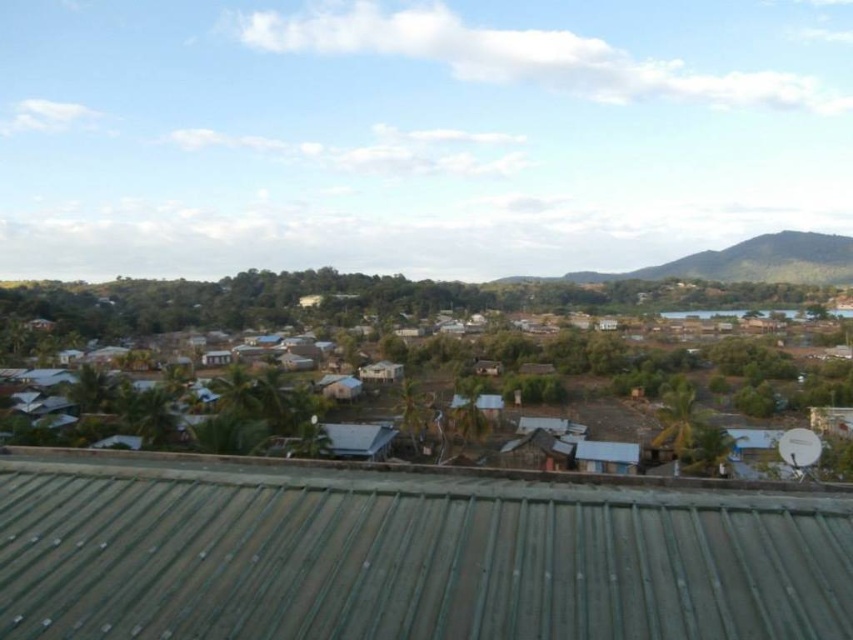
Is metallic roofs at center wider than green textured hill at upper right?

Indeed, metallic roofs at center has a greater width compared to green textured hill at upper right.

Between metallic roofs at center and green textured hill at upper right, which one has more height?

metallic roofs at center is taller.

The width and height of the screenshot is (853, 640). What are the coordinates of `metallic roofs at center` in the screenshot? It's located at (469, 346).

Is green corrugated metal roof at center to the left of green textured hill at upper right from the viewer's perspective?

Correct, you'll find green corrugated metal roof at center to the left of green textured hill at upper right.

Is point (640, 552) behind point (764, 280)?

That is False.

Describe the element at coordinates (405, 557) in the screenshot. I see `green corrugated metal roof at center` at that location.

Identify the location of green corrugated metal roof at center. This screenshot has width=853, height=640. (405, 557).

Does green corrugated metal roof at center have a greater width compared to metallic roofs at center?

No.

Between green corrugated metal roof at center and metallic roofs at center, which one has less height?

Standing shorter between the two is green corrugated metal roof at center.

The height and width of the screenshot is (640, 853). What are the coordinates of `green corrugated metal roof at center` in the screenshot? It's located at (405, 557).